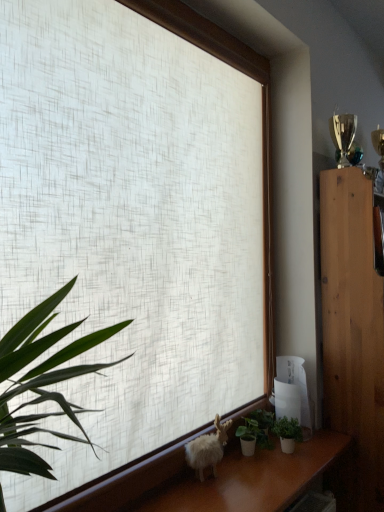
Question: Is white textured fabric at center smaller than white fluffy goat at lower center?

Choices:
 (A) yes
 (B) no

Answer: (B)

Question: Considering the relative sizes of white textured fabric at center and white fluffy goat at lower center in the image provided, is white textured fabric at center taller than white fluffy goat at lower center?

Choices:
 (A) yes
 (B) no

Answer: (A)

Question: From a real-world perspective, does white textured fabric at center stand above white fluffy goat at lower center?

Choices:
 (A) no
 (B) yes

Answer: (B)

Question: Is white textured fabric at center next to white fluffy goat at lower center?

Choices:
 (A) yes
 (B) no

Answer: (B)

Question: Is white textured fabric at center positioned beyond the bounds of white fluffy goat at lower center?

Choices:
 (A) no
 (B) yes

Answer: (B)

Question: Does point (182, 88) appear closer or farther from the camera than point (196, 445)?

Choices:
 (A) farther
 (B) closer

Answer: (A)

Question: In the image, is white textured fabric at center positioned in front of or behind white fluffy goat at lower center?

Choices:
 (A) behind
 (B) front

Answer: (B)

Question: Considering the positions of white textured fabric at center and white fluffy goat at lower center in the image, is white textured fabric at center wider or thinner than white fluffy goat at lower center?

Choices:
 (A) thin
 (B) wide

Answer: (B)

Question: From a real-world perspective, is white textured fabric at center above or below white fluffy goat at lower center?

Choices:
 (A) above
 (B) below

Answer: (A)

Question: Based on their sizes in the image, would you say green matte houseplant at lower center, marked as the first houseplant in a left-to-right arrangement, is bigger or smaller than green matte plant at lower right, which is the first houseplant from right to left?

Choices:
 (A) big
 (B) small

Answer: (A)

Question: From a real-world perspective, is green matte houseplant at lower center, marked as the first houseplant in a left-to-right arrangement, above or below green matte plant at lower right, which is counted as the 2th houseplant, starting from the left?

Choices:
 (A) above
 (B) below

Answer: (B)

Question: Choose the correct answer: Is green matte houseplant at lower center, marked as the first houseplant in a left-to-right arrangement, inside green matte plant at lower right, which is the first houseplant from right to left, or outside it?

Choices:
 (A) outside
 (B) inside

Answer: (A)

Question: In the image, is green matte houseplant at lower center, which is counted as the second houseplant, starting from the right, positioned in front of or behind green matte plant at lower right, which is the first houseplant from right to left?

Choices:
 (A) front
 (B) behind

Answer: (A)

Question: Is white textured fabric at center wider or thinner than wooden cabinet at right?

Choices:
 (A) wide
 (B) thin

Answer: (A)

Question: From the image's perspective, is white textured fabric at center located above or below wooden cabinet at right?

Choices:
 (A) below
 (B) above

Answer: (B)